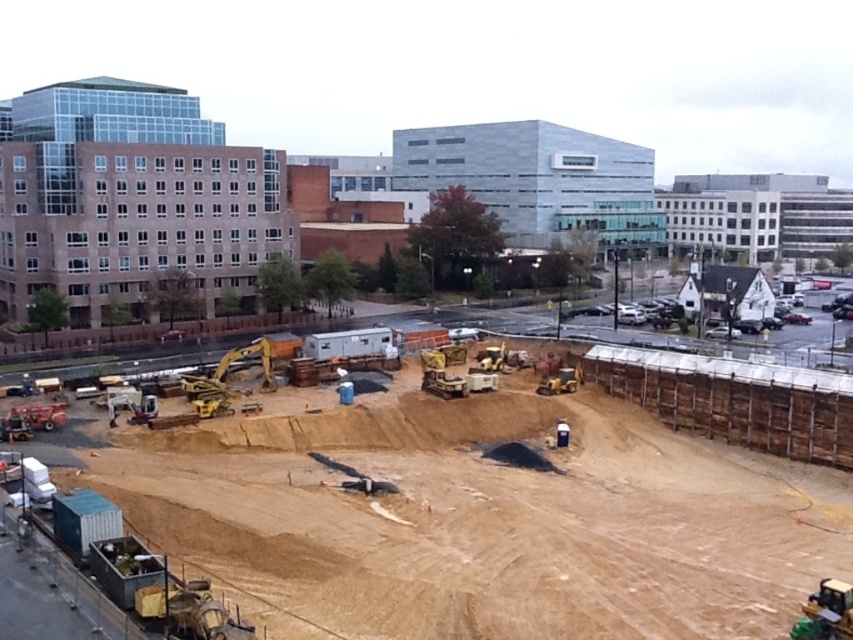
You are a construction worker standing at the entrance of the site located at point 0.0, 0.0. You need to reach the gray metallic building at center to pick up your safety gear. Which direction should you head towards?

You should head towards the gray metallic building at center located at point [537,179], which is northeast from your current position at [0,0].

You are a delivery truck driver arriving at the construction site. You need to unload a heavy crate onto the gray metallic building at center and the yellow rubber at center. Which object should you deliver the crate to first based on their positions?

The gray metallic building at center is positioned on the right side of yellow rubber at center, so you should deliver the crate to the yellow rubber at center first before moving to the gray metallic building at center.

You are a drone operator tasked with capturing aerial footage of the construction site. You need to position your drone to focus on the brown dirt at center. What are the coordinates where you should direct the drone to hover?

The coordinates for the brown dirt at center are at point (473, 516).